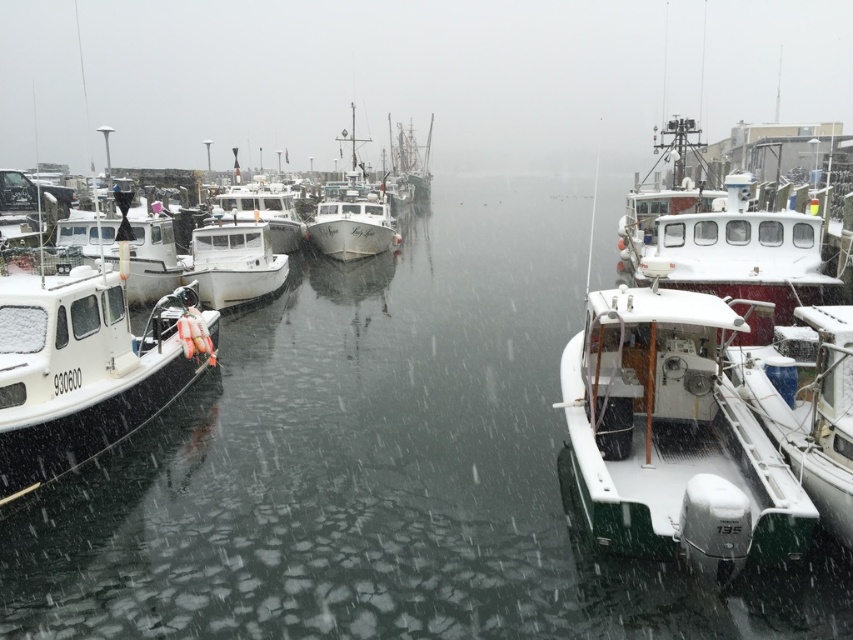
Question: Which of these objects is positioned closest to the white matte boat at left?

Choices:
 (A) white glossy boat at center
 (B) white matte boat at center

Answer: (B)

Question: Which of the following is the farthest from the observer?

Choices:
 (A) (35, 394)
 (B) (814, 436)
 (C) (413, 189)
 (D) (381, 200)

Answer: (C)

Question: Does white matte boat at left lie behind shiny silver ship at center?

Choices:
 (A) yes
 (B) no

Answer: (B)

Question: Can you confirm if white matte boat at left is bigger than shiny silver ship at center?

Choices:
 (A) yes
 (B) no

Answer: (B)

Question: Which point appears farthest from the camera in this image?

Choices:
 (A) (698, 429)
 (B) (334, 200)

Answer: (B)

Question: Does white matte boat at left appear over white glossy boat at center?

Choices:
 (A) yes
 (B) no

Answer: (B)